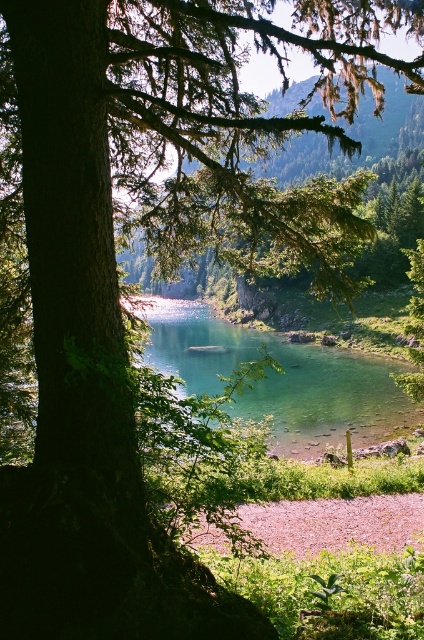
Question: Can you confirm if clear glass water at center is positioned below pink gravel shore at lower center?

Choices:
 (A) no
 (B) yes

Answer: (A)

Question: Is clear glass water at center above pink gravel shore at lower center?

Choices:
 (A) yes
 (B) no

Answer: (A)

Question: In this image, where is clear glass water at center located relative to pink gravel shore at lower center?

Choices:
 (A) above
 (B) below

Answer: (A)